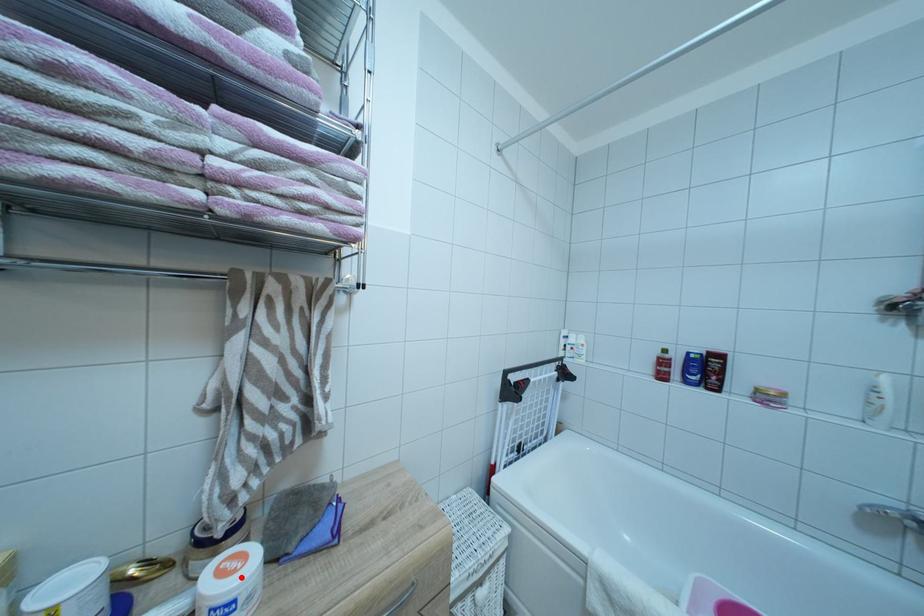
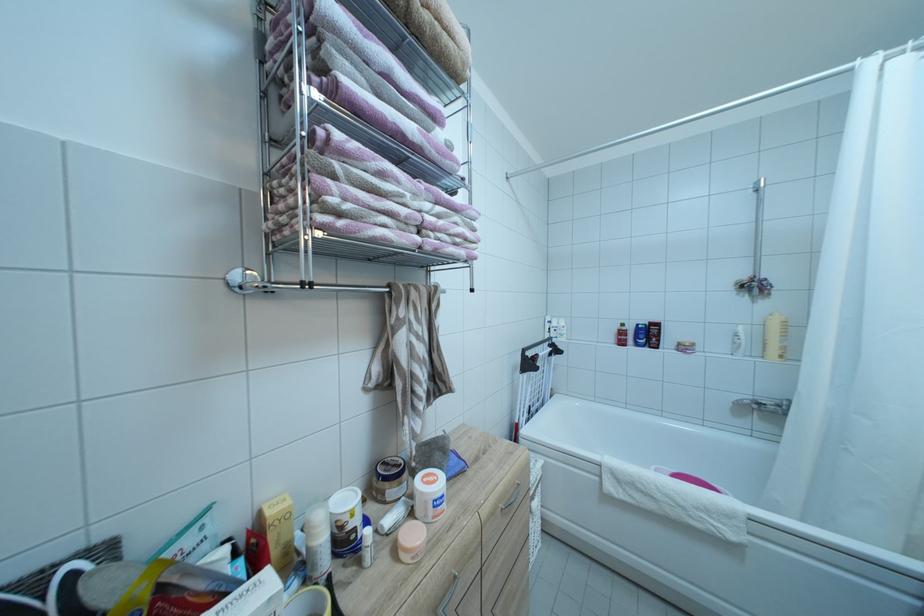
Question: I am providing you with two images of the same scene from different viewpoints. A red point is marked on the first image. Is the red point's position out of view in image 2?

Choices:
 (A) Yes
 (B) No

Answer: (B)